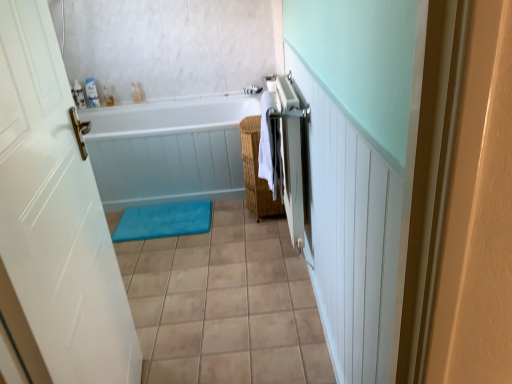
Question: Relative to white woven beach towel at center, is woven brown basket at center-right in front or behind?

Choices:
 (A) behind
 (B) front

Answer: (A)

Question: Is point (252, 188) positioned closer to the camera than point (263, 134)?

Choices:
 (A) closer
 (B) farther

Answer: (B)

Question: Considering the real-world distances, which object is farthest from the white woven beach towel at center?

Choices:
 (A) silver metallic towel rack at right
 (B) woven brown basket at center-right
 (C) beige ceramic tile at center
 (D) white glossy door at left
 (E) blue soft bath mat at center

Answer: (D)

Question: Which of these objects is positioned farthest from the clear plastic bottle at upper left?

Choices:
 (A) white glossy bathtub at center
 (B) silver metallic towel rack at right
 (C) beige ceramic tile at center
 (D) white glossy door at left
 (E) blue soft bath mat at center

Answer: (D)